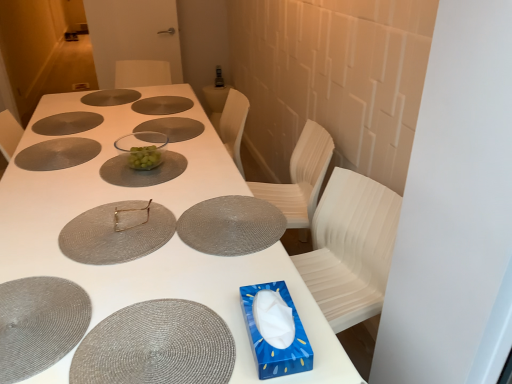
Where is `free area in between matte gray glass plate at upper left, the fifth glass plate when ordered from front to back, and matte gray placemat at center, arranged as the second glass plate when viewed from the front`? Image resolution: width=512 pixels, height=384 pixels. free area in between matte gray glass plate at upper left, the fifth glass plate when ordered from front to back, and matte gray placemat at center, arranged as the second glass plate when viewed from the front is located at coordinates (75, 184).